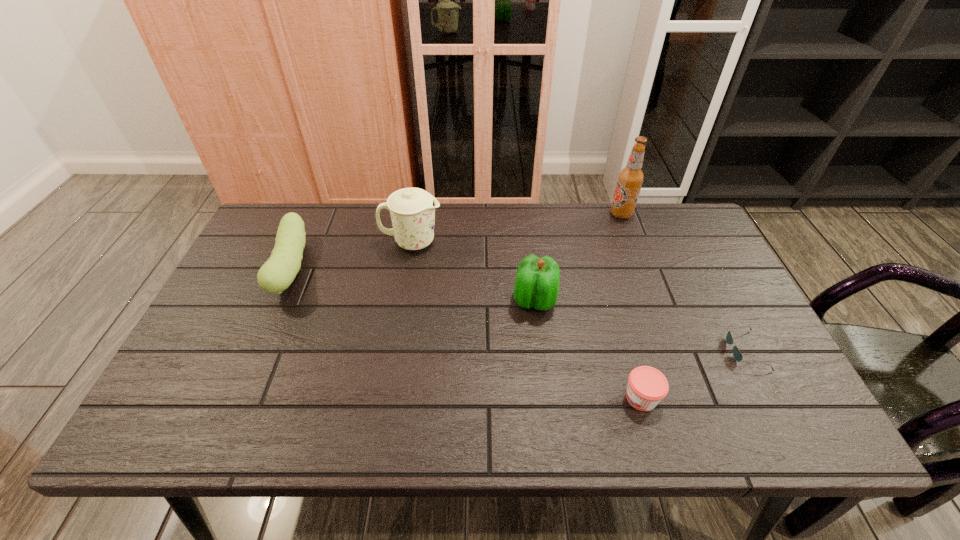
The height and width of the screenshot is (540, 960). I want to click on object located at the far left corner, so click(279, 271).

In the image, there is a desktop. Identify the location of free space at the far edge. This screenshot has height=540, width=960. (600, 227).

Identify the location of vacant space at the near edge of the desktop. (360, 417).

The height and width of the screenshot is (540, 960). I want to click on vacant space at the left edge of the desktop, so click(254, 273).

In the image, there is a desktop. Where is `vacant space at the near left corner`? This screenshot has height=540, width=960. vacant space at the near left corner is located at coordinates (172, 413).

This screenshot has width=960, height=540. In the image, there is a desktop. What are the coordinates of `vacant space at the far right corner` in the screenshot? It's located at click(681, 249).

Find the location of `empty space between the second tallest object and the fourth tallest object`. empty space between the second tallest object and the fourth tallest object is located at coordinates (352, 255).

Locate an element on the screen. The width and height of the screenshot is (960, 540). free space between the leftmost object and the tallest object is located at coordinates (457, 241).

I want to click on vacant area between the second shortest object and the beer bottle, so click(632, 306).

Identify the location of free area in between the cucumber and the tallest object. This screenshot has height=540, width=960. (457, 241).